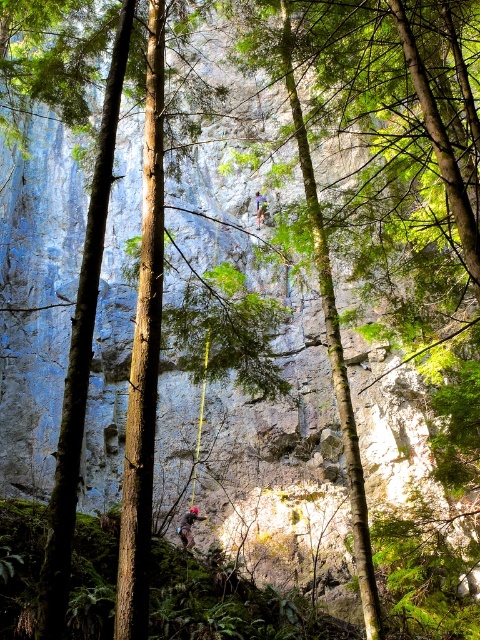
You are a climber looking at the rock face and see two harnesses. The red climbing harness at center and the blue fabric climbing harness at center. Which one is positioned lower on the rock face?

The red climbing harness at center is located below the blue fabric climbing harness at center, so it is positioned lower on the rock face.

You are a rock climber who has just reached the top of the rock face and wants to secure your harness. According to the image, where should you place your red climbing harness at center?

You should place the red climbing harness at center at the coordinates point (188, 525).